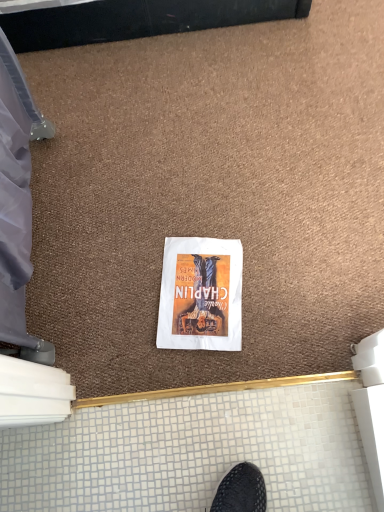
Measure the distance between point [222,244] and camera.

They are 1.11 meters apart.

The width and height of the screenshot is (384, 512). Describe the element at coordinates (201, 295) in the screenshot. I see `matte paper poster at center` at that location.

I want to click on matte paper poster at center, so click(x=201, y=295).

Where is `matte paper poster at center`? The height and width of the screenshot is (512, 384). matte paper poster at center is located at coordinates 201,295.